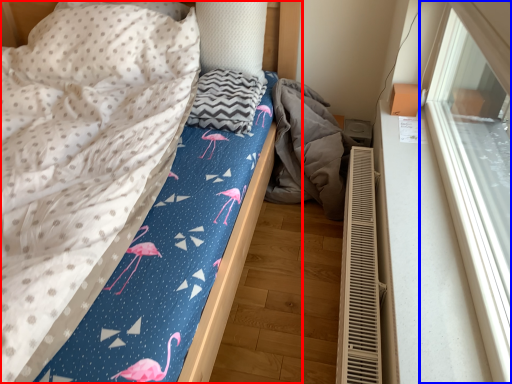
Question: Which of the following is the farthest to the observer, bed (highlighted by a red box) or window (highlighted by a blue box)?

Choices:
 (A) bed
 (B) window

Answer: (A)